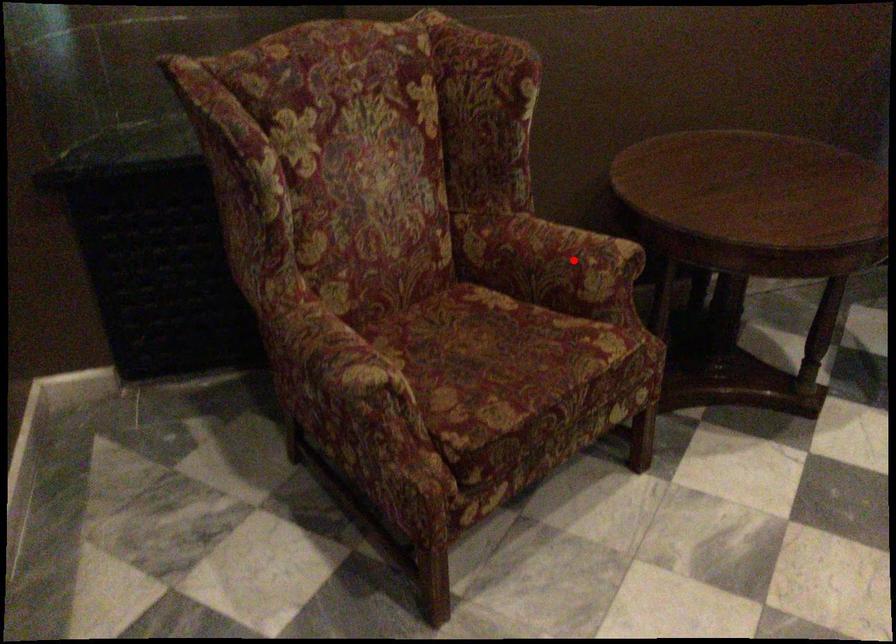
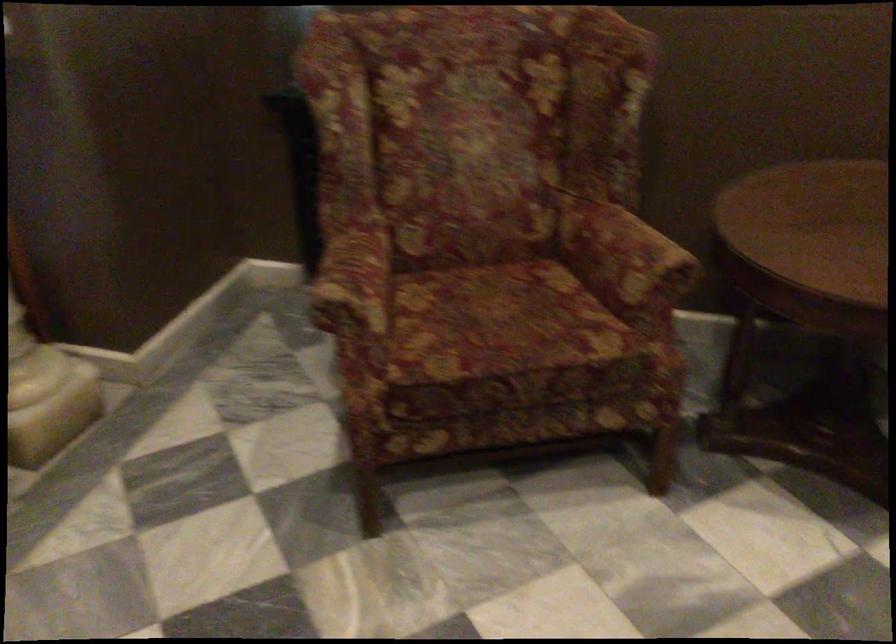
In the second image, find the point that corresponds to the highlighted location in the first image.

(624, 258)